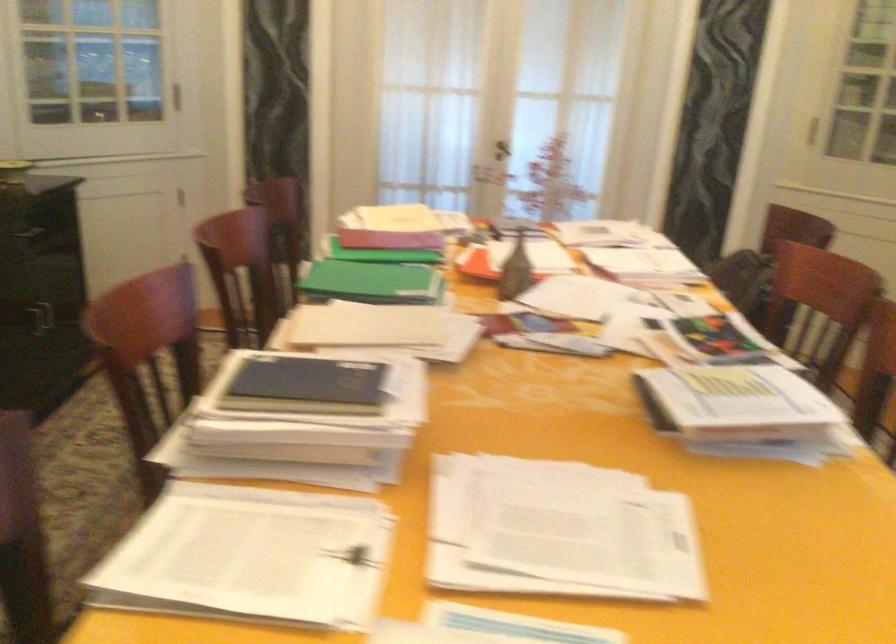
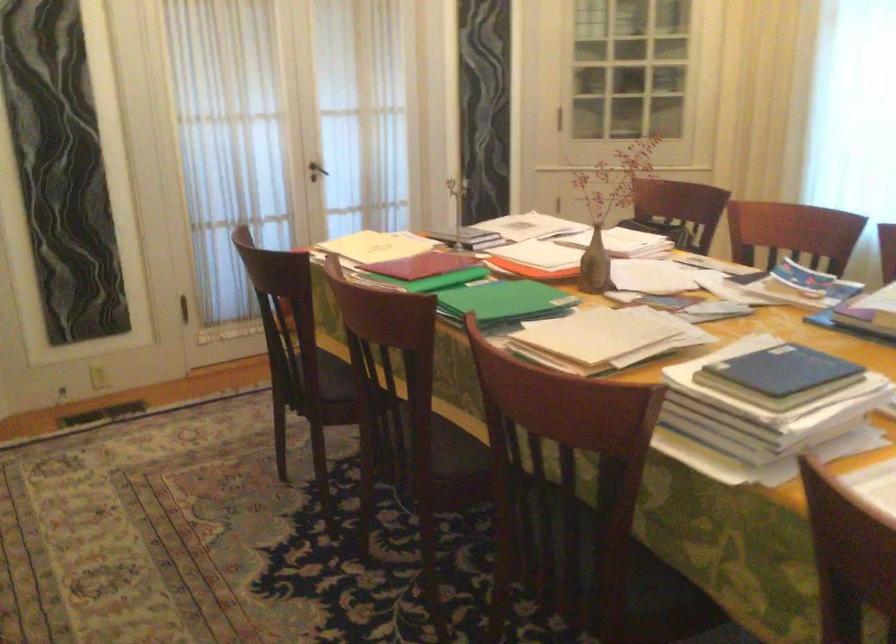
Where in the second image is the point corresponding to pixel 409 219 from the first image?

(376, 245)